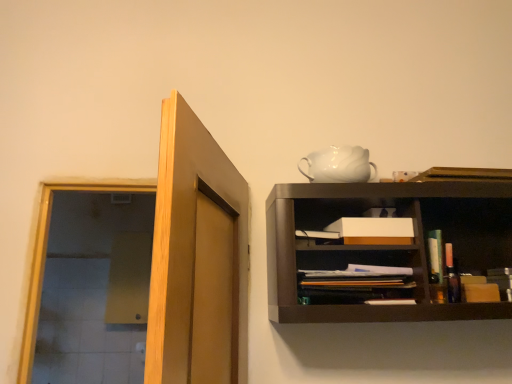
Question: Can you confirm if matte black book at center is smaller than light brown wood door at upper left?

Choices:
 (A) yes
 (B) no

Answer: (A)

Question: Is matte black book at center thinner than light brown wood door at upper left?

Choices:
 (A) no
 (B) yes

Answer: (B)

Question: Is matte black book at center outside of light brown wood door at upper left?

Choices:
 (A) no
 (B) yes

Answer: (B)

Question: Is matte black book at center at the left side of light brown wood door at upper left?

Choices:
 (A) no
 (B) yes

Answer: (A)

Question: Would you say matte black book at center is a long distance from light brown wood door at upper left?

Choices:
 (A) yes
 (B) no

Answer: (B)

Question: Based on their sizes in the image, would you say white matte box at center is bigger or smaller than white glossy teapot at upper center?

Choices:
 (A) big
 (B) small

Answer: (B)

Question: From the image's perspective, relative to white glossy teapot at upper center, is white matte box at center above or below?

Choices:
 (A) above
 (B) below

Answer: (B)

Question: Considering their positions, is white matte box at center located in front of or behind white glossy teapot at upper center?

Choices:
 (A) front
 (B) behind

Answer: (A)

Question: Is point (350, 221) positioned closer to the camera than point (308, 167)?

Choices:
 (A) closer
 (B) farther

Answer: (A)

Question: Visually, is matte black book at center positioned to the left or to the right of light brown wood door at upper left?

Choices:
 (A) left
 (B) right

Answer: (B)

Question: In terms of width, does matte black book at center look wider or thinner when compared to light brown wood door at upper left?

Choices:
 (A) thin
 (B) wide

Answer: (A)

Question: Is matte black book at center inside or outside of light brown wood door at upper left?

Choices:
 (A) inside
 (B) outside

Answer: (B)

Question: Considering the positions of point (361, 286) and point (165, 299), is point (361, 286) closer or farther from the camera than point (165, 299)?

Choices:
 (A) farther
 (B) closer

Answer: (A)

Question: Looking at the image, does white glossy teapot at upper center seem bigger or smaller compared to light brown wood door at upper left?

Choices:
 (A) big
 (B) small

Answer: (B)

Question: In the image, is white glossy teapot at upper center on the left side or the right side of light brown wood door at upper left?

Choices:
 (A) left
 (B) right

Answer: (B)